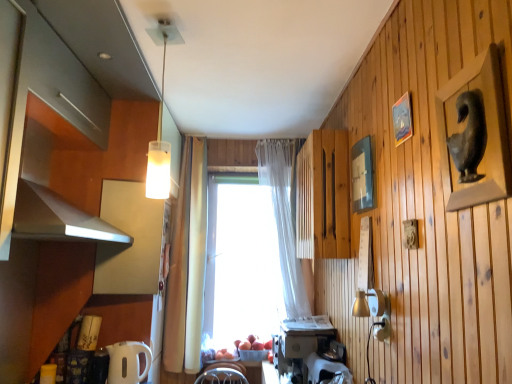
Question: Does wooden slats at center, acting as the 1th cabinetry starting from the right, contain white plastic coffee maker at lower center, which is the second appliance from left to right?

Choices:
 (A) yes
 (B) no

Answer: (B)

Question: From a real-world perspective, is wooden slats at center, the third cabinetry in the left-to-right sequence, physically below white plastic coffee maker at lower center, acting as the 2th appliance starting from the right?

Choices:
 (A) no
 (B) yes

Answer: (A)

Question: From a real-world perspective, is wooden slats at center, the third cabinetry in the left-to-right sequence, positioned over white plastic coffee maker at lower center, acting as the 2th appliance starting from the right, based on gravity?

Choices:
 (A) no
 (B) yes

Answer: (B)

Question: Can you confirm if wooden slats at center, acting as the 1th cabinetry starting from the right, is taller than white plastic coffee maker at lower center, which is the second appliance from left to right?

Choices:
 (A) yes
 (B) no

Answer: (A)

Question: Considering the relative sizes of wooden slats at center, acting as the 1th cabinetry starting from the right, and white plastic coffee maker at lower center, acting as the 2th appliance starting from the right, in the image provided, is wooden slats at center, acting as the 1th cabinetry starting from the right, shorter than white plastic coffee maker at lower center, acting as the 2th appliance starting from the right,?

Choices:
 (A) no
 (B) yes

Answer: (A)

Question: Is white plastic toaster at lower center, which is the 1th appliance in right-to-left order, taller or shorter than matte gray statue at upper right, the third picture frame when ordered from back to front?

Choices:
 (A) tall
 (B) short

Answer: (B)

Question: In the image, is white plastic toaster at lower center, which is the 1th appliance in right-to-left order, on the left side or the right side of matte gray statue at upper right, the third picture frame when ordered from back to front?

Choices:
 (A) right
 (B) left

Answer: (B)

Question: Is point (310, 362) positioned closer to the camera than point (502, 110)?

Choices:
 (A) closer
 (B) farther

Answer: (B)

Question: Relative to matte gray statue at upper right, the first picture frame when ordered from front to back, is white plastic toaster at lower center, which is the 1th appliance in right-to-left order, in front or behind?

Choices:
 (A) front
 (B) behind

Answer: (B)

Question: Is point (287, 253) closer or farther from the camera than point (143, 213)?

Choices:
 (A) closer
 (B) farther

Answer: (B)

Question: Choose the correct answer: Is translucent fabric curtain at center inside matte white cabinet at left, acting as the 2th cabinetry starting from the right, or outside it?

Choices:
 (A) outside
 (B) inside

Answer: (A)

Question: From their relative heights in the image, would you say translucent fabric curtain at center is taller or shorter than matte white cabinet at left, acting as the 2th cabinetry starting from the right?

Choices:
 (A) short
 (B) tall

Answer: (B)

Question: From the image's perspective, is translucent fabric curtain at center above or below matte white cabinet at left, the second cabinetry when ordered from left to right?

Choices:
 (A) below
 (B) above

Answer: (A)

Question: From the image's perspective, is matte wood cabinet at upper left, which is the third cabinetry in right-to-left order, positioned above or below wooden picture frame at upper right, the 2th picture frame when ordered from front to back?

Choices:
 (A) above
 (B) below

Answer: (A)

Question: Looking at the image, does matte wood cabinet at upper left, the first cabinetry when ordered from left to right, seem bigger or smaller compared to wooden picture frame at upper right, which is the second picture frame from back to front?

Choices:
 (A) big
 (B) small

Answer: (A)